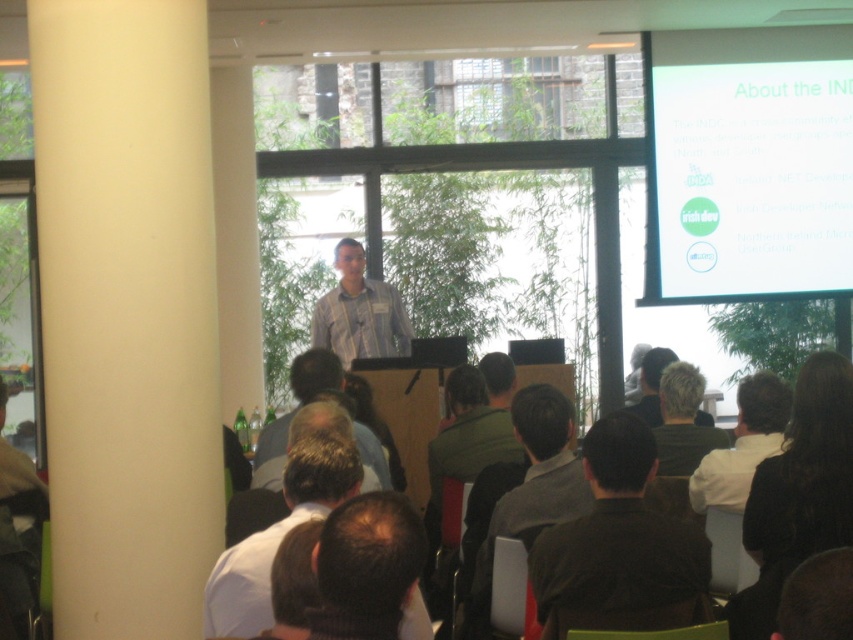
You are organizing a photo shoot for a magazine and need to capture the two people with dark brown hair at center and blonde hair at center. The camera frame can only accommodate one of them at a time. Based on their hair widths, which person should you prioritize to fit within the frame?

The dark brown hair at center has a larger width than the blonde hair at center, so prioritizing the person with dark brown hair at center would ensure their hair fits better within the camera frame.

You are standing in the presentation room and want to approach the speaker with dark brown hair at center. Given that you are 1.7 meters tall, can you comfortably walk towards them without any obstacles?

The distance between you and the dark brown hair at center is 3.67 meters, so yes, you can comfortably walk towards them as there are no obstacles mentioned in the scene description.

You are an attendee at the presentation and want to wave to the speaker. You notice the white shirt at upper right and dark brown hair at center in the audience. Which of these two people is closer to your right side?

The white shirt at upper right is to the right of dark brown hair at center, so the white shirt at upper right is closer to your right side.